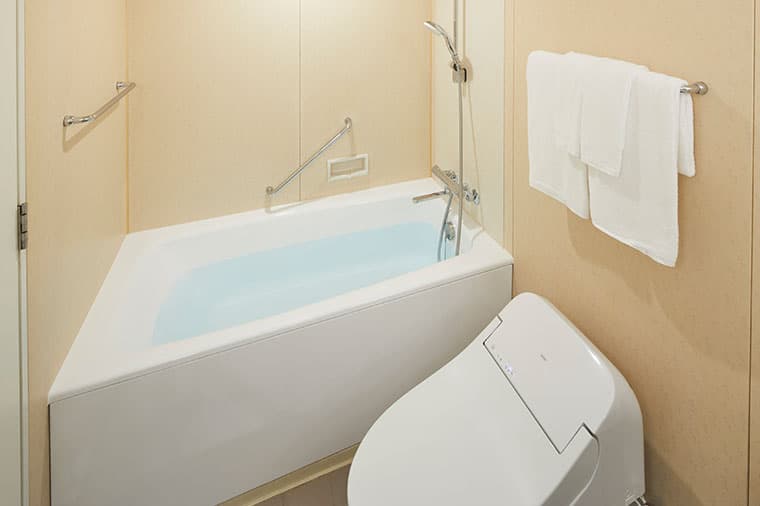
The height and width of the screenshot is (506, 760). I want to click on towel bar, so click(257, 340).